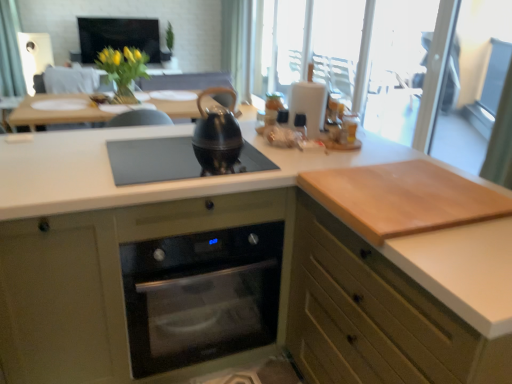
Find the location of a particular element. This screenshot has width=512, height=384. vacant space situated above wooden cutting board at right, placed as the second cabinetry when sorted from left to right (from a real-world perspective) is located at coordinates (401, 181).